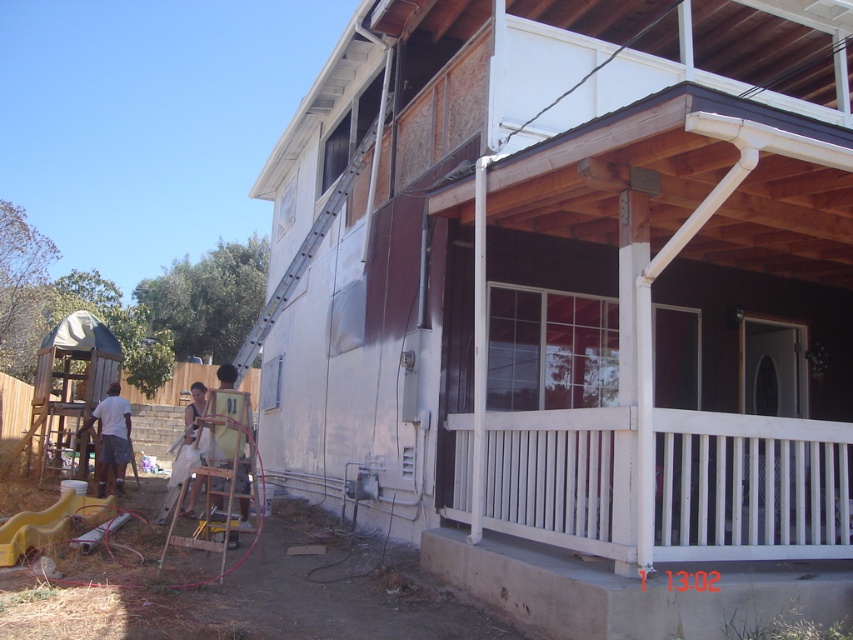
You are standing in front of the house and see the white wooden porch at center and the white cotton shirt at left. Which object is positioned more to the left side of the house?

The white cotton shirt at left is positioned more to the left side of the house than the white wooden porch at center.